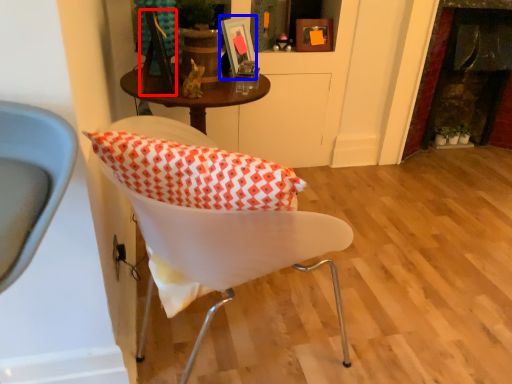
Question: Which object appears closest to the camera in this image, picture frame (highlighted by a red box) or picture frame (highlighted by a blue box)?

Choices:
 (A) picture frame
 (B) picture frame

Answer: (A)